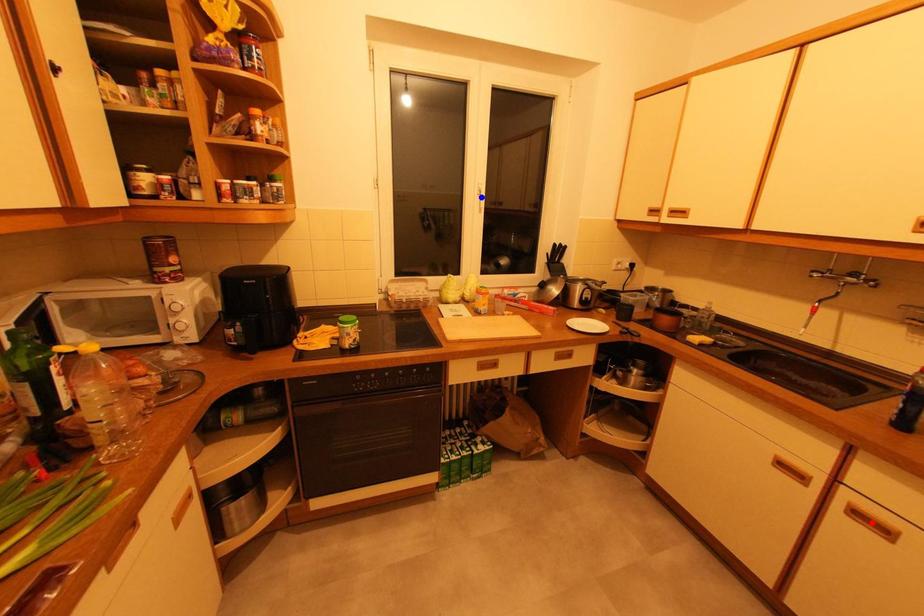
Question: Which of the two points in the image is closer to the camera?

Choices:
 (A) Blue point is closer.
 (B) Red point is closer.

Answer: (B)